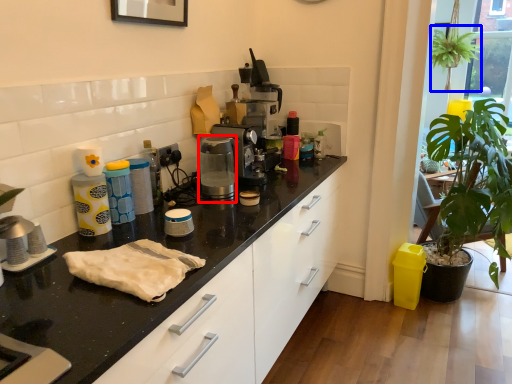
Question: Which point is closer to the camera, coffee machine (highlighted by a red box) or plant (highlighted by a blue box)?

Choices:
 (A) coffee machine
 (B) plant

Answer: (A)